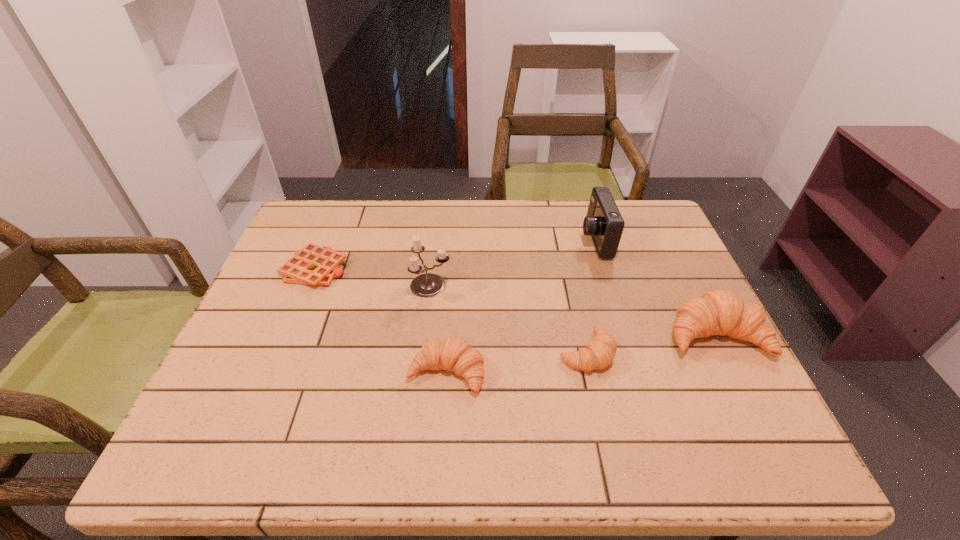
The height and width of the screenshot is (540, 960). Find the location of `object that is at the left edge`. object that is at the left edge is located at coordinates (314, 265).

At what (x,y) coordinates should I click in order to perform the action: click on object that is at the right edge. Please return your answer as a coordinate pair (x, y). The image size is (960, 540). Looking at the image, I should click on (720, 312).

In order to click on free space at the far edge of the desktop in this screenshot , I will do 588,240.

I want to click on vacant space at the near edge of the desktop, so click(627, 381).

Locate an element on the screen. free space at the left edge is located at coordinates (282, 375).

At what (x,y) coordinates should I click in order to perform the action: click on free space at the right edge. Please return your answer as a coordinate pair (x, y). Image resolution: width=960 pixels, height=540 pixels. Looking at the image, I should click on (687, 278).

The width and height of the screenshot is (960, 540). In the image, there is a desktop. Identify the location of blank space at the far left corner. (287, 240).

Where is `free point at the near left corner`? The image size is (960, 540). free point at the near left corner is located at coordinates (279, 383).

You are a GUI agent. You are given a task and a screenshot of the screen. Output one action in this format:
    pyautogui.click(x=<x>, y=<y>)
    Task: Click on the vacant space at the far right corner of the desktop
    This screenshot has width=960, height=540.
    Given the screenshot: What is the action you would take?
    pyautogui.click(x=660, y=233)

Locate an element on the screen. This screenshot has width=960, height=540. empty space that is in between the camera and the candle holder is located at coordinates tap(513, 262).